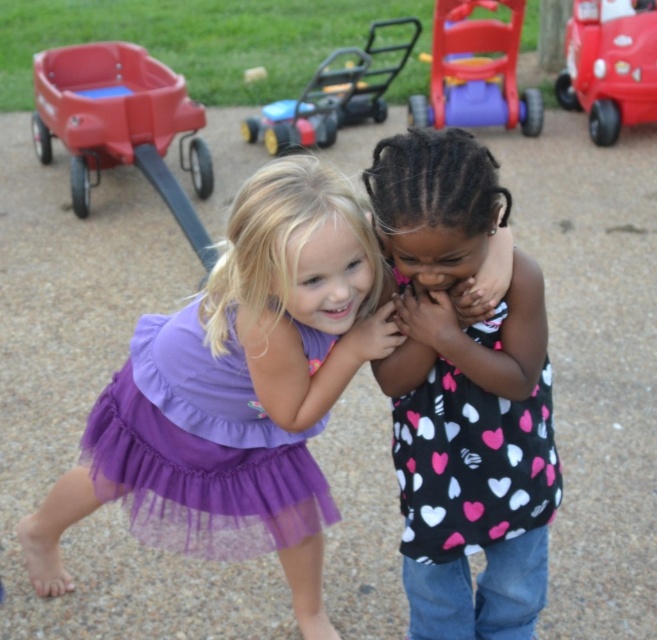
You are a photographer trying to capture a closeup shot of the two points in the image. Which point, point [309,273] or point [403,275], will appear larger in your photo?

Point [309,273] will appear larger in the photo because it is closer to the camera than point [403,275].

You are a photographer trying to capture a candid shot of the black polka dot tank top at center and the matte plastic wagon at upper left. Which object should you focus on first if you want to include both in the frame without moving the camera?

The matte plastic wagon at upper left should be focused on first because the black polka dot tank top at center is positioned to its right, so capturing the wagon first ensures the tank top will also be in the frame.

You are a photographer setting up a shoot in this scene. You need to ensure that the black polka dot tank top at center and the matte plastic wagon at upper left are both in focus. Given their sizes, which object should you adjust your camera settings to prioritize focusing on first?

The black polka dot tank top at center is smaller than the matte plastic wagon at upper left, so you should prioritize focusing on the matte plastic wagon at upper left first since larger objects may require more precise focus adjustments.